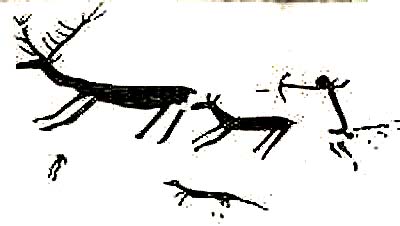
In order to click on small deer's head in this screenshot , I will do `click(196, 106)`.